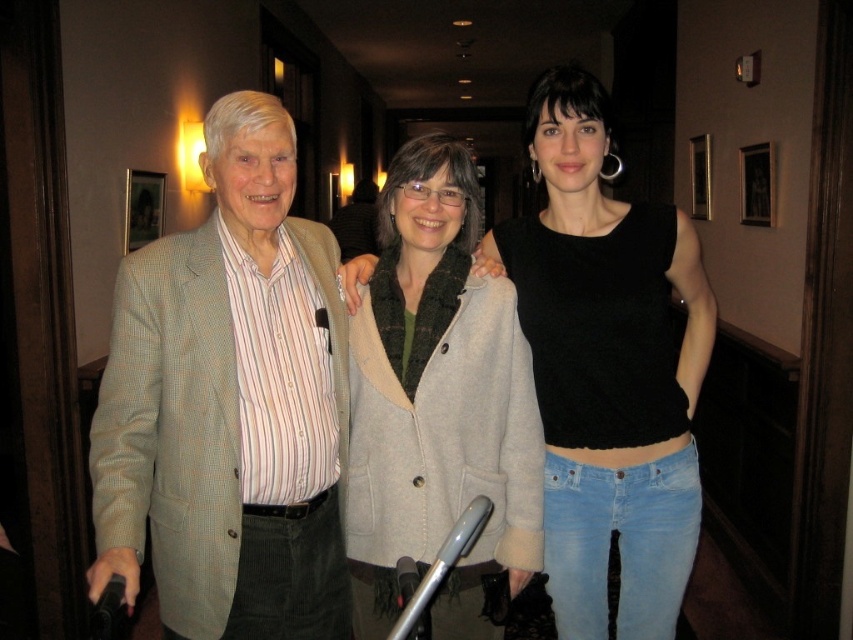
Who is positioned more to the left, light brown wool jacket at left or black matte tank top at center?

light brown wool jacket at left is more to the left.

Where is `light brown wool jacket at left`? light brown wool jacket at left is located at coordinates (229, 404).

Describe the element at coordinates (606, 369) in the screenshot. I see `black matte tank top at center` at that location.

Does black matte tank top at center have a smaller size compared to light gray wool coat at center?

Actually, black matte tank top at center might be larger than light gray wool coat at center.

Find the location of a particular element. Image resolution: width=853 pixels, height=640 pixels. black matte tank top at center is located at coordinates (606, 369).

Does point (167, 314) come closer to viewer compared to point (525, 380)?

That is True.

Does point (155, 387) lie behind point (418, 531)?

No, (155, 387) is closer to viewer.

Does point (306, 332) come closer to viewer compared to point (355, 547)?

Yes, it is.

Locate an element on the screen. light brown wool jacket at left is located at coordinates (229, 404).